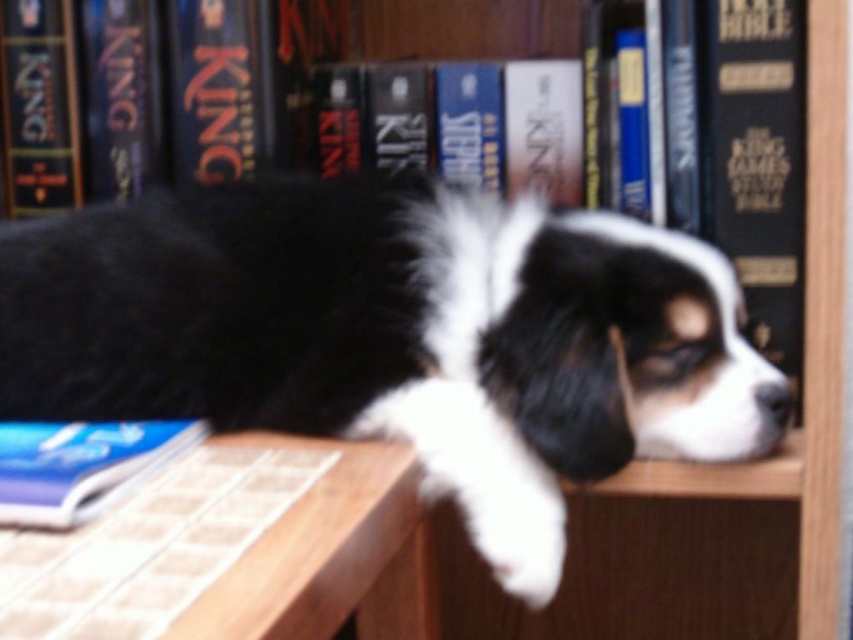
Question: Which object is positioned closest to the black and white fur at center?

Choices:
 (A) blue paperback book at lower left
 (B) wooden table at lower left
 (C) hardcover book at upper right

Answer: (B)

Question: Based on their relative distances, which object is farther from the wooden table at lower left?

Choices:
 (A) blue paperback book at lower left
 (B) black and white fur at center

Answer: (B)

Question: Is black and white fur at center thinner than wooden table at lower left?

Choices:
 (A) no
 (B) yes

Answer: (A)

Question: Can you confirm if hardcover book at upper right is positioned below blue paperback book at lower left?

Choices:
 (A) no
 (B) yes

Answer: (A)

Question: Is black and white fur at center bigger than wooden table at lower left?

Choices:
 (A) no
 (B) yes

Answer: (B)

Question: Estimate the real-world distances between objects in this image. Which object is closer to the black and white fur at center?

Choices:
 (A) wooden table at lower left
 (B) hardcover book at upper right

Answer: (A)